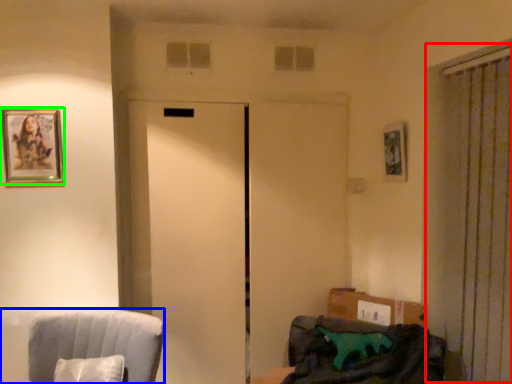
Question: Which object is positioned closest to curtain (highlighted by a red box)? Select from furniture (highlighted by a blue box) and picture frame (highlighted by a green box).

Choices:
 (A) furniture
 (B) picture frame

Answer: (A)